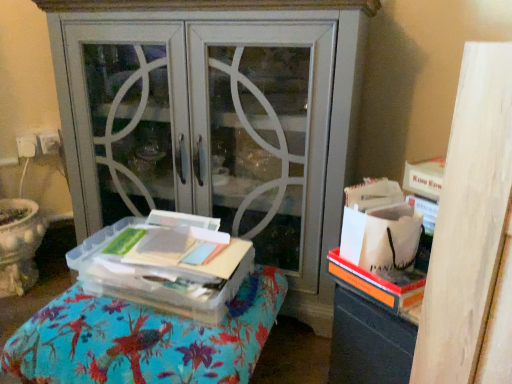
Question: From the image's perspective, is clear plastic container at center located above or below matte gray cabinet at center?

Choices:
 (A) above
 (B) below

Answer: (B)

Question: Does point (177, 276) appear closer or farther from the camera than point (181, 137)?

Choices:
 (A) farther
 (B) closer

Answer: (B)

Question: Estimate the real-world distances between objects in this image. Which object is closer to the clear plastic container at center?

Choices:
 (A) matte gray cabinet at center
 (B) clear plastic container at center

Answer: (B)

Question: Based on their relative distances, which object is farther from the matte gray cabinet at center?

Choices:
 (A) clear plastic container at center
 (B) clear plastic container at center

Answer: (B)